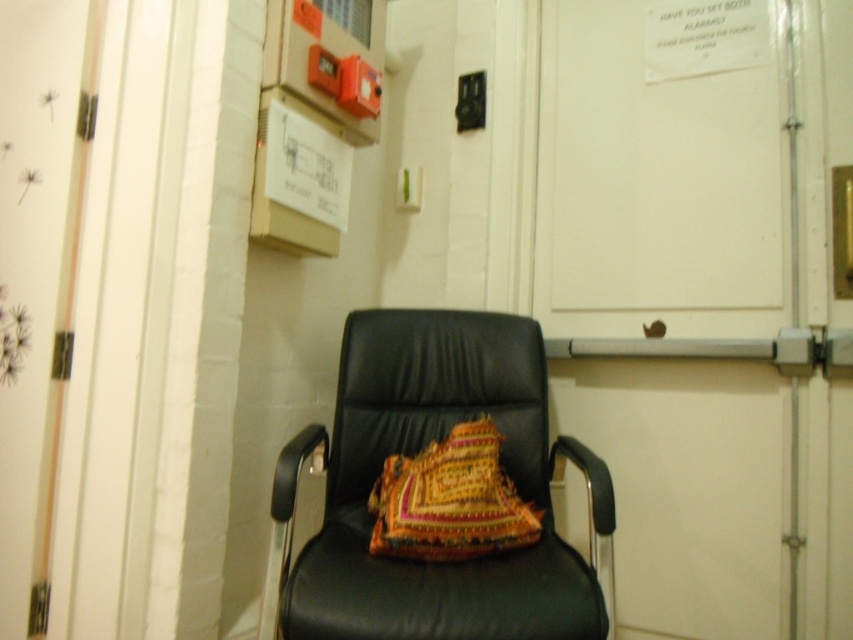
You are planning to place a new desk in the room where the black leather swivel chair at center and the multicolored knitted pillow at center are located. Considering their sizes, which object should you avoid placing too close to the desk to ensure there is enough space?

The black leather swivel chair at center is larger than the multicolored knitted pillow at center, so you should avoid placing the chair too close to the desk to ensure there is enough space.

You are an office worker trying to sit comfortably on the black leather swivel chair at center. You notice the multicolored knitted pillow at center is in the way. Can you move the pillow to the side to make space?

The black leather swivel chair at center is in front of the multicolored knitted pillow at center, so you can move the pillow to the side to make space.